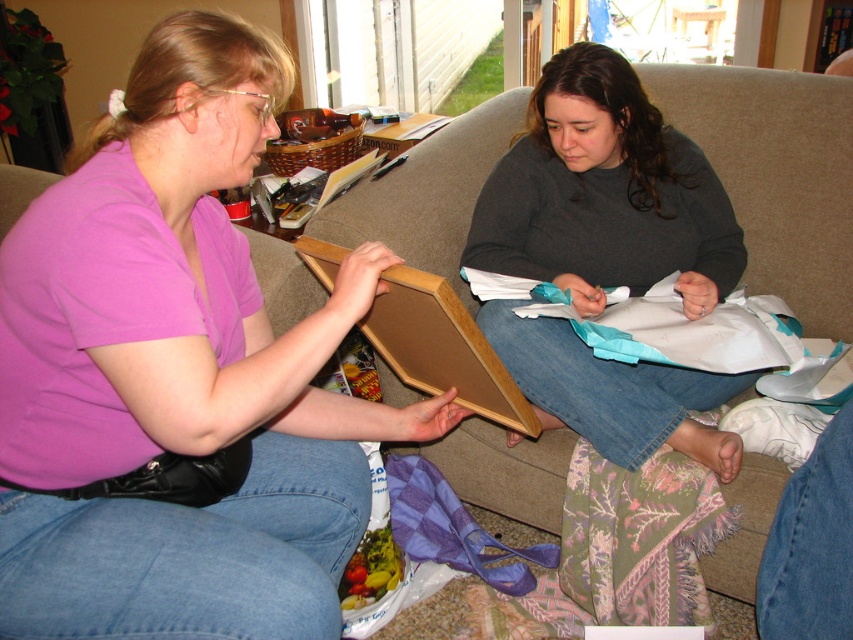
You are a photographer setting up a shoot in the room. You need to position a light source so it illuminates the matte pink shirt at left without affecting the beige fabric couch at center. Based on their positions, where should you place the light relative to the couch?

The matte pink shirt at left is located below the beige fabric couch at center, so placing the light source above the couch would direct light downward onto the shirt while avoiding the couch itself.

You are organizing a clothing donation drive and need to sort items based on their positions. If the dark gray sweater at center is placed on the right side of the donation bin, where should you place the matte pink shirt at left to maintain their original spatial relationship?

The matte pink shirt at left should be placed to the left of the dark gray sweater at center on the donation bin to maintain their original spatial relationship.